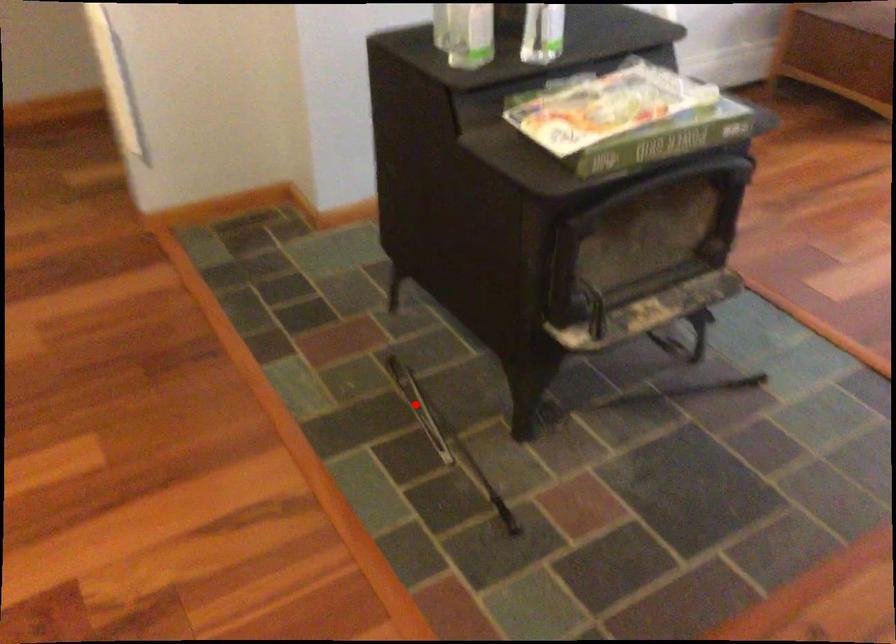
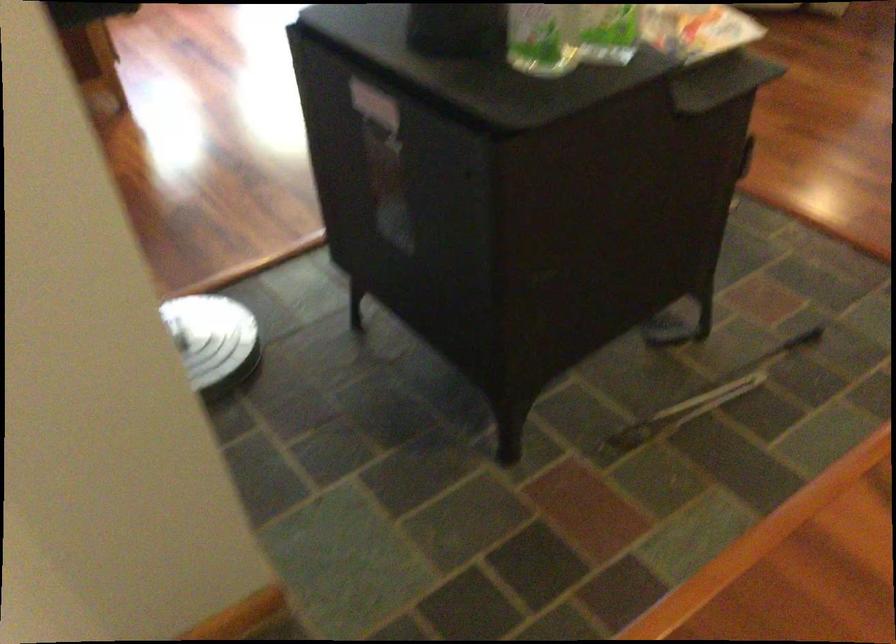
Question: I am providing you with two images of the same scene from different viewpoints. In image1, a red point is highlighted. Considering the same 3D point in image2, which of the following is correct?

Choices:
 (A) It is closer
 (B) It is farther

Answer: (A)